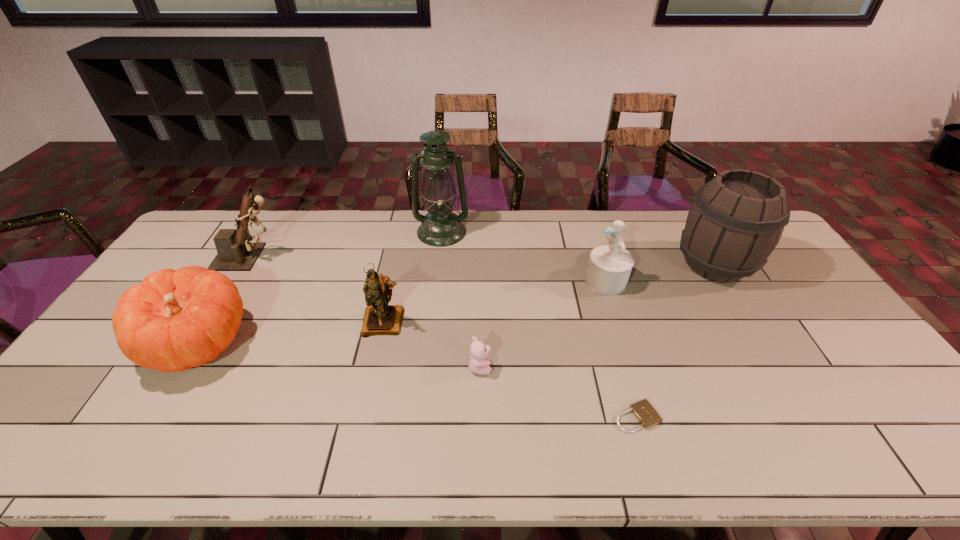
Find the location of a particular element. oil lamp at the far edge is located at coordinates (441, 227).

The width and height of the screenshot is (960, 540). I want to click on wine bucket present at the far edge, so click(736, 220).

Find the location of a particular element. The width and height of the screenshot is (960, 540). figurine that is positioned at the far edge is located at coordinates (237, 251).

Locate an element on the screen. This screenshot has height=540, width=960. object that is at the near edge is located at coordinates (644, 412).

Image resolution: width=960 pixels, height=540 pixels. In order to click on figurine that is at the left edge in this screenshot , I will do `click(237, 251)`.

Where is `pumpkin situated at the left edge`? The width and height of the screenshot is (960, 540). pumpkin situated at the left edge is located at coordinates (174, 320).

Where is `object positioned at the right edge`? This screenshot has height=540, width=960. object positioned at the right edge is located at coordinates (736, 220).

At what (x,y) coordinates should I click in order to perform the action: click on object present at the far left corner. Please return your answer as a coordinate pair (x, y). The width and height of the screenshot is (960, 540). Looking at the image, I should click on (237, 251).

In order to click on object that is at the far right corner in this screenshot , I will do `click(736, 220)`.

Where is `vacant space at the far edge`? The height and width of the screenshot is (540, 960). vacant space at the far edge is located at coordinates click(571, 236).